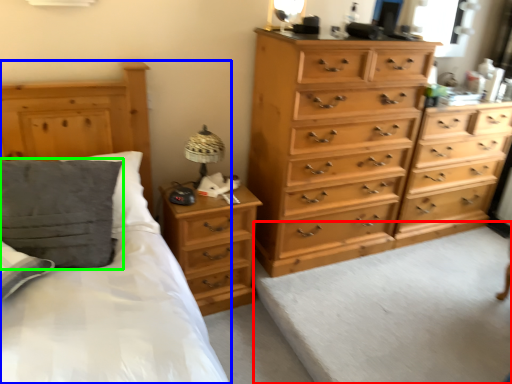
Question: Which is farther away from plain (highlighted by a red box)? bed (highlighted by a blue box) or pillow (highlighted by a green box)?

Choices:
 (A) bed
 (B) pillow

Answer: (B)